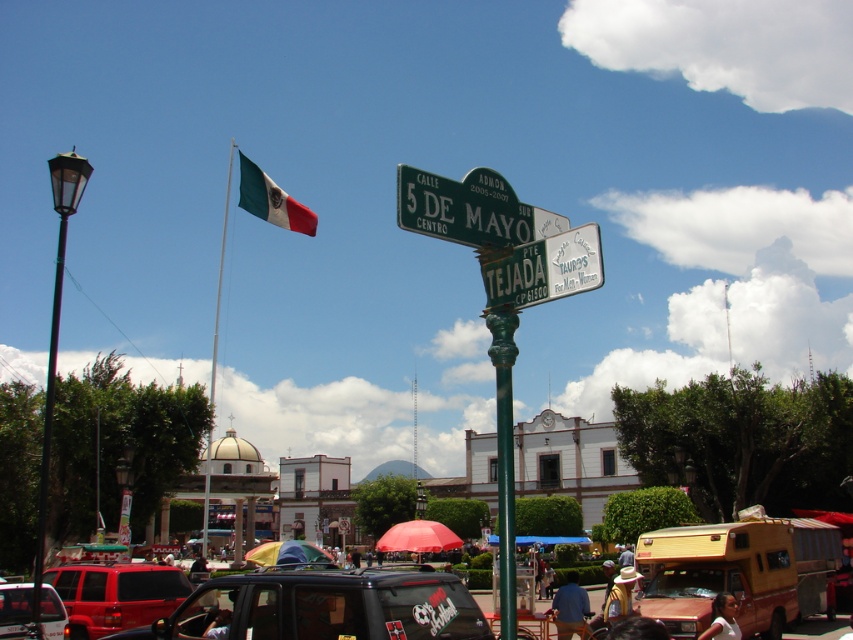
Is metallic green street sign at upper center to the left of green painted metal pole at center from the viewer's perspective?

Indeed, metallic green street sign at upper center is positioned on the left side of green painted metal pole at center.

Measure the distance between point [537,280] and camera.

Point [537,280] is 12.36 meters away from camera.

The width and height of the screenshot is (853, 640). I want to click on metallic green street sign at upper center, so click(544, 268).

Between green metallic street sign at upper center and matte red suv at center, which one is positioned higher?

Positioned higher is green metallic street sign at upper center.

Which of these two, green metallic street sign at upper center or matte red suv at center, stands shorter?

With less height is matte red suv at center.

What are the coordinates of `green metallic street sign at upper center` in the screenshot? It's located at (469, 209).

The height and width of the screenshot is (640, 853). Identify the location of green metallic street sign at upper center. (469, 209).

Can you confirm if green metallic street sign at upper center is smaller than green and white striped flag at upper left?

Yes, green metallic street sign at upper center is smaller than green and white striped flag at upper left.

Does green metallic street sign at upper center appear on the right side of green and white striped flag at upper left?

Indeed, green metallic street sign at upper center is positioned on the right side of green and white striped flag at upper left.

Is point (415, 173) closer to viewer compared to point (314, 234)?

Yes, it is in front of point (314, 234).

Locate an element on the screen. green metallic street sign at upper center is located at coordinates (469, 209).